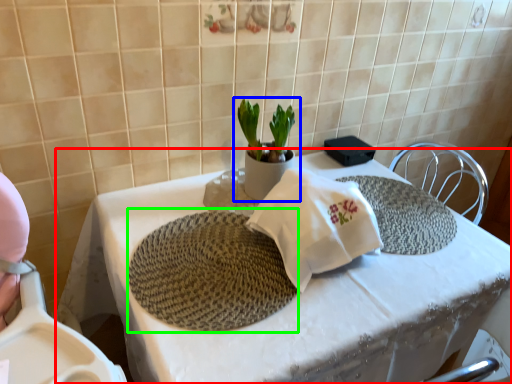
Question: Which object is the farthest from table (highlighted by a red box)? Choose among these: houseplant (highlighted by a blue box) or mat (highlighted by a green box).

Choices:
 (A) houseplant
 (B) mat

Answer: (A)